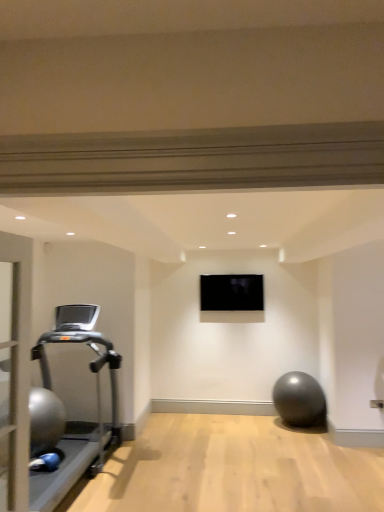
Question: Would you say black glossy tv at center is to the left or to the right of silver metallic treadmill at left in the picture?

Choices:
 (A) left
 (B) right

Answer: (B)

Question: Is black glossy tv at center in front of or behind silver metallic treadmill at left in the image?

Choices:
 (A) behind
 (B) front

Answer: (A)

Question: Do you think black glossy tv at center is within silver metallic treadmill at left, or outside of it?

Choices:
 (A) outside
 (B) inside

Answer: (A)

Question: Considering the positions of silver metallic treadmill at left and black glossy tv at center in the image, is silver metallic treadmill at left wider or thinner than black glossy tv at center?

Choices:
 (A) thin
 (B) wide

Answer: (B)

Question: Do you think silver metallic treadmill at left is within black glossy tv at center, or outside of it?

Choices:
 (A) inside
 (B) outside

Answer: (B)

Question: Looking at the image, does silver metallic treadmill at left seem bigger or smaller compared to black glossy tv at center?

Choices:
 (A) small
 (B) big

Answer: (B)

Question: From a real-world perspective, is silver metallic treadmill at left positioned above or below black glossy tv at center?

Choices:
 (A) below
 (B) above

Answer: (A)